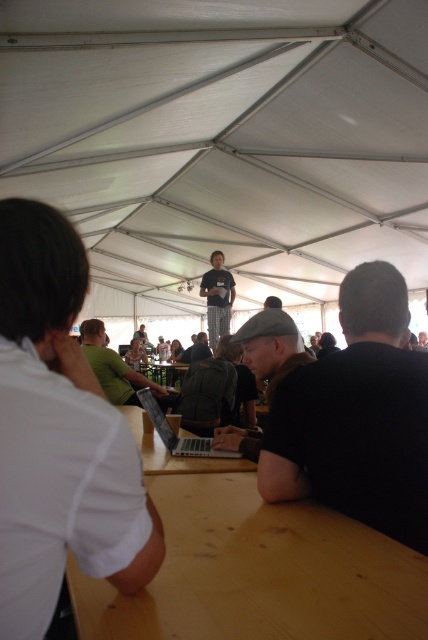
Question: Is the position of wooden table at center more distant than that of dark gray shirt at center?

Choices:
 (A) yes
 (B) no

Answer: (B)

Question: Can you confirm if gray woolen cap at center is positioned to the left of green fabric shirt at center?

Choices:
 (A) no
 (B) yes

Answer: (A)

Question: Based on their relative distances, which object is farther from the light brown wood table at lower center?

Choices:
 (A) light brown wooden table at center
 (B) wooden table at center

Answer: (A)

Question: Which of the following is the closest to the observer?

Choices:
 (A) coord(231,442)
 (B) coord(425,552)

Answer: (B)

Question: Does light brown wood table at lower center have a smaller size compared to wooden table at center?

Choices:
 (A) yes
 (B) no

Answer: (A)

Question: Which object is positioned closest to the light brown wood table at lower center?

Choices:
 (A) white matte shirt at left
 (B) wooden table at center
 (C) dark gray shirt at center
 (D) gray woolen cap at center

Answer: (A)